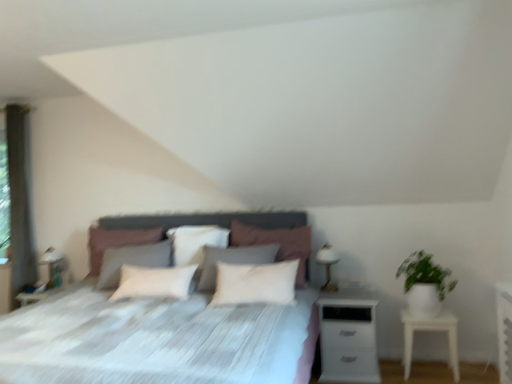
The height and width of the screenshot is (384, 512). What do you see at coordinates (52, 267) in the screenshot?
I see `white glossy table lamp at left, the first table lamp from the left` at bounding box center [52, 267].

Image resolution: width=512 pixels, height=384 pixels. What do you see at coordinates (425, 273) in the screenshot?
I see `green matte plant at right` at bounding box center [425, 273].

Describe the element at coordinates (116, 242) in the screenshot. I see `white soft pillow at center, the first pillow in the left-to-right sequence` at that location.

The image size is (512, 384). I want to click on white matte nightstand at right, which is the 1th nightstand in right-to-left order, so click(431, 330).

You are a GUI agent. You are given a task and a screenshot of the screen. Output one action in this format:
    pyautogui.click(x=<x>, y=<y>)
    Task: Click on the white glossy table lamp at right, the 1th table lamp from the right
    This screenshot has height=384, width=512.
    Given the screenshot: What is the action you would take?
    pyautogui.click(x=328, y=265)

What is the approximate height of white matte nightstand at right, acting as the 1th nightstand starting from the left?

white matte nightstand at right, acting as the 1th nightstand starting from the left, is 62.48 centimeters in height.

I want to click on white soft pillow at center, marked as the first pillow in a right-to-left arrangement, so click(x=276, y=242).

The image size is (512, 384). Describe the element at coordinates (276, 242) in the screenshot. I see `white soft pillow at center, which ranks as the third pillow in left-to-right order` at that location.

The height and width of the screenshot is (384, 512). Identify the location of white glossy table lamp at left, which ranks as the 2th table lamp in front-to-back order. (52, 267).

Is white matte nightstand at right, marked as the second nightstand in a right-to-left arrangement, facing towards green matte plant at right?

No, white matte nightstand at right, marked as the second nightstand in a right-to-left arrangement, is not turned towards green matte plant at right.

Can you confirm if white matte nightstand at right, acting as the 1th nightstand starting from the left, is positioned to the left of green matte plant at right?

Correct, you'll find white matte nightstand at right, acting as the 1th nightstand starting from the left, to the left of green matte plant at right.

Looking at the image, does white matte nightstand at right, marked as the second nightstand in a right-to-left arrangement, seem bigger or smaller compared to green matte plant at right?

white matte nightstand at right, marked as the second nightstand in a right-to-left arrangement, is bigger than green matte plant at right.

From a real-world perspective, who is located higher, white matte nightstand at right, marked as the second nightstand in a right-to-left arrangement, or green matte plant at right?

green matte plant at right.

Considering the positions of objects white soft pillow at center, the first pillow in the left-to-right sequence, and green matte plant at right in the image provided, who is more to the left, white soft pillow at center, the first pillow in the left-to-right sequence, or green matte plant at right?

From the viewer's perspective, white soft pillow at center, the first pillow in the left-to-right sequence, appears more on the left side.

Considering the points (89, 230) and (402, 267), which point is behind, point (89, 230) or point (402, 267)?

The point (89, 230) is behind.

Which of these two, white soft pillow at center, acting as the 3th pillow starting from the right, or green matte plant at right, is bigger?

Bigger between the two is white soft pillow at center, acting as the 3th pillow starting from the right.

From a real-world perspective, between white soft pillow at center, the first pillow in the left-to-right sequence, and green matte plant at right, who is vertically lower?

In real-world perspective, green matte plant at right is lower.

You are a GUI agent. You are given a task and a screenshot of the screen. Output one action in this format:
    pyautogui.click(x=<x>, y=<y>)
    Task: Click on the plant that is on the right side of white fabric bed at center
    
    Given the screenshot: What is the action you would take?
    pyautogui.click(x=425, y=273)

Is white fabric bed at center inside green matte plant at right?

No, green matte plant at right does not contain white fabric bed at center.

Would you say green matte plant at right is to the left or to the right of white fabric bed at center in the picture?

From the image, it's evident that green matte plant at right is to the right of white fabric bed at center.

Considering the points (410, 284) and (73, 374), which point is in front, point (410, 284) or point (73, 374)?

Point (73, 374)

Considering the relative sizes of green matte plant at right and white soft pillow at center, marked as the first pillow in a right-to-left arrangement, in the image provided, is green matte plant at right wider than white soft pillow at center, marked as the first pillow in a right-to-left arrangement,?

Correct, the width of green matte plant at right exceeds that of white soft pillow at center, marked as the first pillow in a right-to-left arrangement.

Is green matte plant at right closer to the viewer compared to white soft pillow at center, which ranks as the third pillow in left-to-right order?

Yes, green matte plant at right is closer to the camera.

Which is correct: green matte plant at right is inside white soft pillow at center, which ranks as the third pillow in left-to-right order, or outside of it?

green matte plant at right is located beyond the bounds of white soft pillow at center, which ranks as the third pillow in left-to-right order.

Is green matte plant at right next to white soft pillow at center, which ranks as the third pillow in left-to-right order?

No, green matte plant at right is not next to white soft pillow at center, which ranks as the third pillow in left-to-right order.

Is white glossy table lamp at left, the second table lamp viewed from the right, not inside white soft pillow at center, the first pillow in the left-to-right sequence?

white glossy table lamp at left, the second table lamp viewed from the right, is positioned outside white soft pillow at center, the first pillow in the left-to-right sequence.

Which of these two, white glossy table lamp at left, the second table lamp viewed from the right, or white soft pillow at center, the first pillow in the left-to-right sequence, stands taller?

Standing taller between the two is white soft pillow at center, the first pillow in the left-to-right sequence.

Is white glossy table lamp at left, the 1th table lamp in the back-to-front sequence, oriented away from white soft pillow at center, acting as the 3th pillow starting from the right?

No, white glossy table lamp at left, the 1th table lamp in the back-to-front sequence, is not facing away from white soft pillow at center, acting as the 3th pillow starting from the right.

Is white glossy table lamp at left, the first table lamp from the left, touching white soft pillow at center, the first pillow in the left-to-right sequence?

white glossy table lamp at left, the first table lamp from the left, is not next to white soft pillow at center, the first pillow in the left-to-right sequence, and they're not touching.

From a real-world perspective, which object stands above the other?

From a 3D spatial view, white soft pillow at center, which ranks as the third pillow in left-to-right order, is above.

From the image's perspective, which one is positioned higher, white soft pillow at center, acting as the 3th pillow starting from the right, or white soft pillow at center, which ranks as the third pillow in left-to-right order?

white soft pillow at center, which ranks as the third pillow in left-to-right order, from the image's perspective.

Is white soft pillow at center, acting as the 3th pillow starting from the right, positioned with its back to white soft pillow at center, which ranks as the third pillow in left-to-right order?

No, white soft pillow at center, acting as the 3th pillow starting from the right,'s orientation is not away from white soft pillow at center, which ranks as the third pillow in left-to-right order.

Between white soft pillow at center, the first pillow in the left-to-right sequence, and white soft pillow at center, marked as the first pillow in a right-to-left arrangement, which one has smaller width?

white soft pillow at center, the first pillow in the left-to-right sequence, is thinner.

Would you say white matte nightstand at right, which is the 1th nightstand in right-to-left order, is inside or outside white soft pillow at center, the first pillow in the left-to-right sequence?

white matte nightstand at right, which is the 1th nightstand in right-to-left order, exists outside the volume of white soft pillow at center, the first pillow in the left-to-right sequence.

From the image's perspective, is white matte nightstand at right, which is the 1th nightstand in right-to-left order, below white soft pillow at center, the first pillow in the left-to-right sequence?

Correct, white matte nightstand at right, which is the 1th nightstand in right-to-left order, appears lower than white soft pillow at center, the first pillow in the left-to-right sequence, in the image.

Could you tell me if white matte nightstand at right, arranged as the second nightstand when viewed from the left, is facing white soft pillow at center, acting as the 3th pillow starting from the right?

No, white matte nightstand at right, arranged as the second nightstand when viewed from the left, is not aimed at white soft pillow at center, acting as the 3th pillow starting from the right.

Considering the points (453, 348) and (113, 237), which point is in front, point (453, 348) or point (113, 237)?

The point (453, 348) is more forward.

At what (x,y) coordinates should I click in order to perform the action: click on plant above the white matte nightstand at right, acting as the 1th nightstand starting from the left (from a real-world perspective). Please return your answer as a coordinate pair (x, y). Looking at the image, I should click on (425, 273).

From the green matte plant at right, count the 3rd pillow to the left and point to it. Please provide its 2D coordinates.

[(116, 242)]

When comparing their distances from green matte plant at right, does gray fabric curtain at left or white soft pillow at center, marked as the first pillow in a right-to-left arrangement, seem closer?

Based on the image, white soft pillow at center, marked as the first pillow in a right-to-left arrangement, appears to be nearer to green matte plant at right.

When comparing their distances from white soft pillow at center, the first pillow in the left-to-right sequence, does white glossy table lamp at left, the 1th table lamp in the back-to-front sequence, or white soft pillow at center, positioned as the second pillow in left-to-right order, seem further?

white glossy table lamp at left, the 1th table lamp in the back-to-front sequence, is further to white soft pillow at center, the first pillow in the left-to-right sequence.

Based on their spatial positions, is white glossy table lamp at right, which is counted as the second table lamp, starting from the left, or white matte nightstand at right, acting as the 1th nightstand starting from the left, closer to green matte plant at right?

Among the two, white matte nightstand at right, acting as the 1th nightstand starting from the left, is located nearer to green matte plant at right.

When comparing their distances from white matte nightstand at right, arranged as the second nightstand when viewed from the left, does white matte nightstand at right, marked as the second nightstand in a right-to-left arrangement, or white glossy table lamp at right, the 1th table lamp from the right, seem closer?

Based on the image, white matte nightstand at right, marked as the second nightstand in a right-to-left arrangement, appears to be nearer to white matte nightstand at right, arranged as the second nightstand when viewed from the left.

Which object lies nearer to the anchor point white fabric bed at center, white soft pillow at center, the first pillow in the left-to-right sequence, or white soft pillow at center, positioned as the second pillow in left-to-right order?

white soft pillow at center, positioned as the second pillow in left-to-right order, lies closer to white fabric bed at center than the other object.

Estimate the real-world distances between objects in this image. Which object is further from gray fabric curtain at left, white soft pillow at center, positioned as the second pillow in left-to-right order, or white glossy table lamp at right, the 1th table lamp from the right?

white glossy table lamp at right, the 1th table lamp from the right, lies further to gray fabric curtain at left than the other object.

Considering their positions, is white soft pillow at center, which ranks as the third pillow in left-to-right order, positioned further to white soft pillow at center, which appears as the 2th pillow when viewed from the right, than white glossy table lamp at right, which is counted as the second table lamp, starting from the left?

white glossy table lamp at right, which is counted as the second table lamp, starting from the left.

Looking at the image, which one is located further to white soft pillow at center, positioned as the second pillow in left-to-right order, gray fabric curtain at left or white glossy table lamp at left, the second table lamp viewed from the right?

Among the two, gray fabric curtain at left is located further to white soft pillow at center, positioned as the second pillow in left-to-right order.

Locate an element on the screen. table lamp located between gray fabric curtain at left and white glossy table lamp at right, the first table lamp from the front, in the left-right direction is located at coordinates (52, 267).

Image resolution: width=512 pixels, height=384 pixels. What are the coordinates of `nightstand between white fabric bed at center and green matte plant at right from left to right` in the screenshot? It's located at (348, 337).

Where is `table lamp between white soft pillow at center, which ranks as the third pillow in left-to-right order, and white matte nightstand at right, arranged as the second nightstand when viewed from the left`? The width and height of the screenshot is (512, 384). table lamp between white soft pillow at center, which ranks as the third pillow in left-to-right order, and white matte nightstand at right, arranged as the second nightstand when viewed from the left is located at coordinates tap(328, 265).

Identify the location of plant between white soft pillow at center, which ranks as the third pillow in left-to-right order, and white matte nightstand at right, which is the 1th nightstand in right-to-left order. (425, 273).